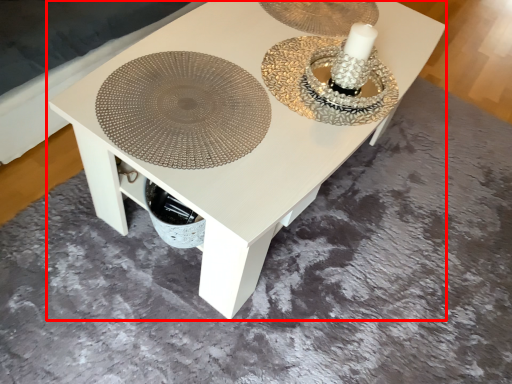
Question: In this image, where is table (annotated by the red box) located relative to platter?

Choices:
 (A) right
 (B) left

Answer: (A)